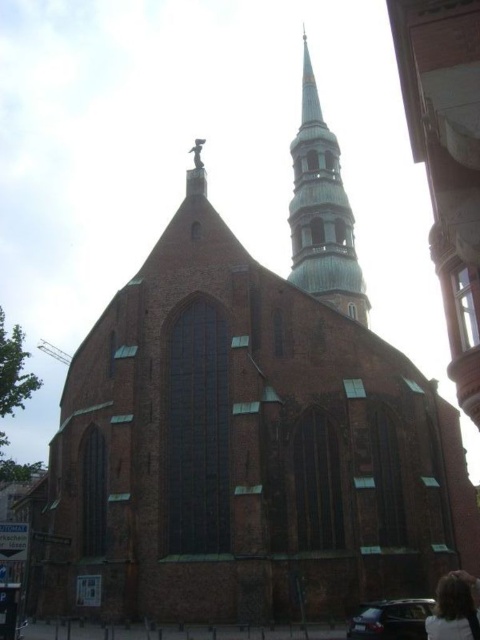
Question: Considering the relative positions of green copper spire at upper center and blonde hair at lower right in the image provided, where is green copper spire at upper center located with respect to blonde hair at lower right?

Choices:
 (A) above
 (B) below

Answer: (A)

Question: Can you confirm if green copper spire at upper center is thinner than blonde hair at lower right?

Choices:
 (A) no
 (B) yes

Answer: (A)

Question: Which point is closer to the camera taking this photo?

Choices:
 (A) (296, 218)
 (B) (458, 620)

Answer: (B)

Question: In this image, where is green copper spire at upper center located relative to blonde hair at lower right?

Choices:
 (A) below
 (B) above

Answer: (B)